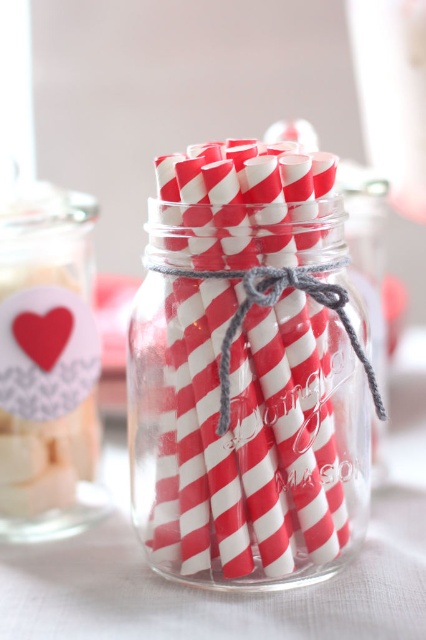
You are organizing a party and need to decide if the red striped straws at center can fit into the matte white glass jar at upper left. Based on their sizes, what would you conclude?

The red striped straws at center is larger in size than the matte white glass jar at upper left, so the straws cannot fit into the jar.

You are organizing a Valentine party and need to place the red striped straws at center and the matte paper heart at center on a shelf. Which object should you place first to ensure the shorter one doesn

The matte paper heart at center should be placed first because it is shorter than the red striped straws at center, allowing the taller straws to be placed behind or beside it without blocking the view of the heart.